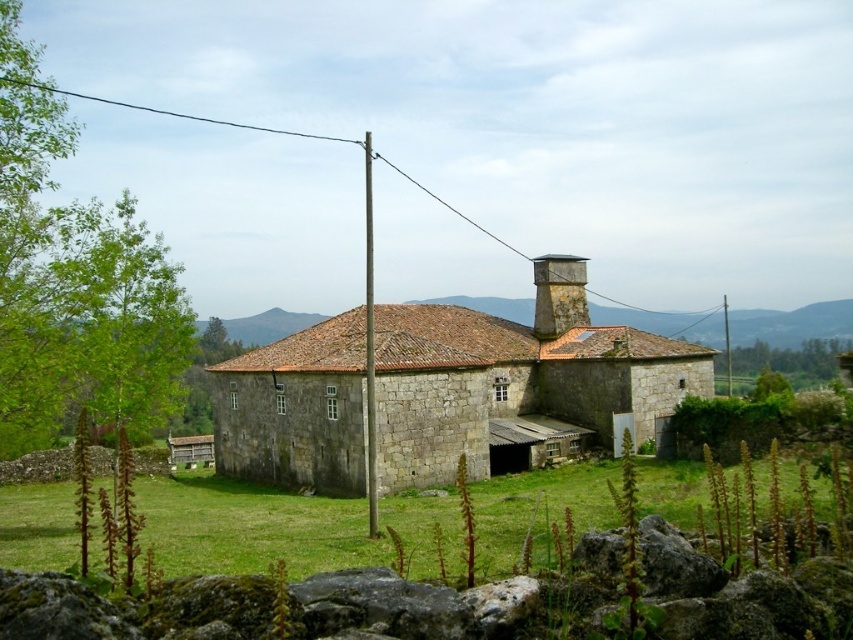
Question: Which of the following is the closest to the observer?

Choices:
 (A) (579, 314)
 (B) (64, 488)

Answer: (B)

Question: Does green grass at lower center come behind stone chimney at upper center?

Choices:
 (A) no
 (B) yes

Answer: (A)

Question: Which object is closer to the camera taking this photo?

Choices:
 (A) green grass at lower center
 (B) stone chimney at upper center

Answer: (A)

Question: Does green grass at lower center lie in front of stone chimney at upper center?

Choices:
 (A) yes
 (B) no

Answer: (A)

Question: Where is green grass at lower center located in relation to stone chimney at upper center in the image?

Choices:
 (A) right
 (B) left

Answer: (B)